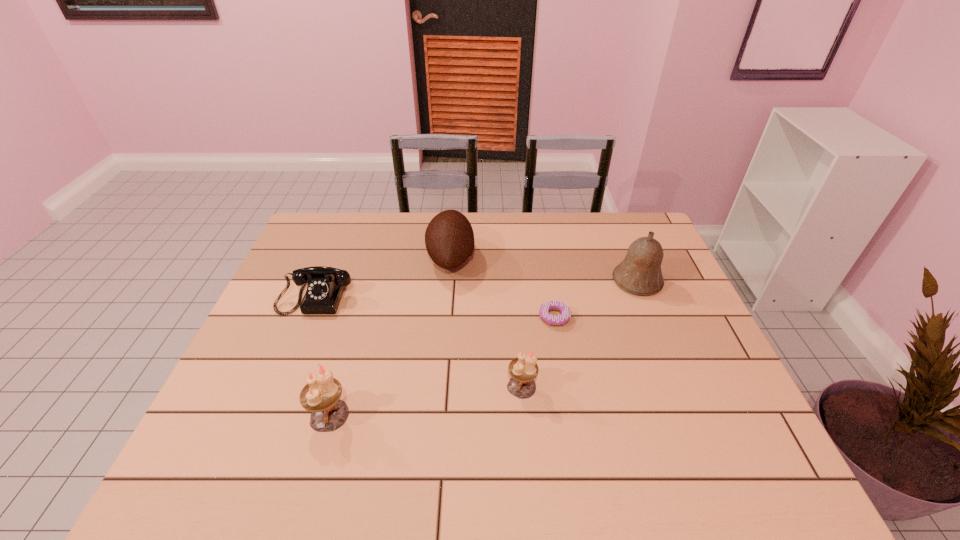
What are the coordinates of `free region that satisfies the following two spatial constraints: 1. on the dial of the shorter candle holder; 2. on the right side of the second shortest object` in the screenshot? It's located at (281, 386).

Where is `free space that satisfies the following two spatial constraints: 1. on the laces of the fourth object from right to left; 2. on the back side of the shorter candle holder`? free space that satisfies the following two spatial constraints: 1. on the laces of the fourth object from right to left; 2. on the back side of the shorter candle holder is located at coordinates (441, 386).

Locate an element on the screen. The height and width of the screenshot is (540, 960). blank area in the image that satisfies the following two spatial constraints: 1. on the back side of the right candle holder; 2. on the laces of the third object from left to right is located at coordinates (511, 258).